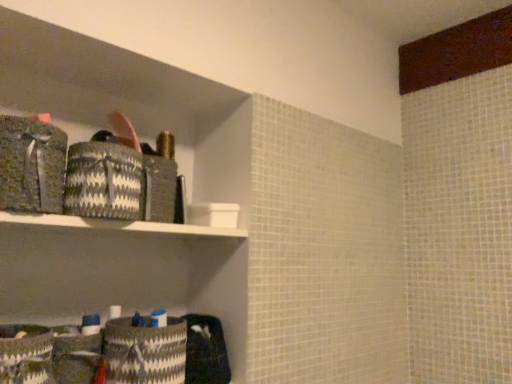
Question: In the image, is white and black woven basket at lower left, which ranks as the first material in bottom-to-top order, positioned in front of or behind black and white woven basket at upper left, which appears as the 2th material when ordered from the bottom?

Choices:
 (A) front
 (B) behind

Answer: (B)

Question: From the image's perspective, is white and black woven basket at lower left, which ranks as the first material in bottom-to-top order, positioned above or below black and white woven basket at upper left, which appears as the 2th material when viewed from the top?

Choices:
 (A) below
 (B) above

Answer: (A)

Question: Which of these objects is positioned farthest from the white and black woven basket at lower left, which appears as the 3th material when viewed from the top?

Choices:
 (A) white plastic shelf at upper center
 (B) black and white woven basket at upper left, which appears as the 2th material when viewed from the top
 (C) textured gray fabric at left, marked as the 1th material in a top-to-bottom arrangement

Answer: (C)

Question: Which of these objects is positioned farthest from the white and black woven basket at lower left, which appears as the 3th material when viewed from the top?

Choices:
 (A) white plastic shelf at upper center
 (B) textured gray fabric at left, marked as the 1th material in a top-to-bottom arrangement
 (C) black and white woven basket at upper left, which appears as the 2th material when viewed from the top

Answer: (B)